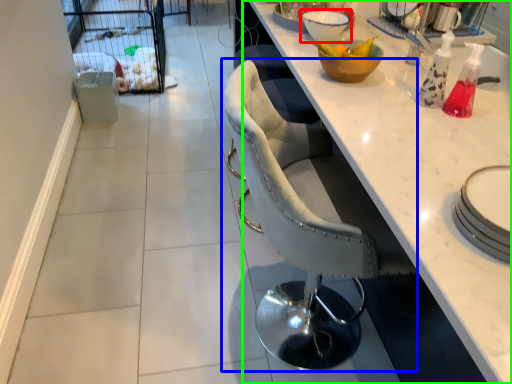
Question: Which is nearer to the bowl (highlighted by a red box)? chair (highlighted by a blue box) or countertop (highlighted by a green box).

Choices:
 (A) chair
 (B) countertop

Answer: (B)